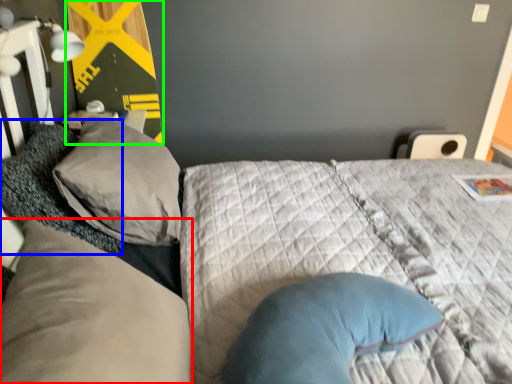
Question: Which is nearer to the pillow (highlighted by a red box)? pillow (highlighted by a blue box) or bulletin board (highlighted by a green box).

Choices:
 (A) pillow
 (B) bulletin board

Answer: (A)